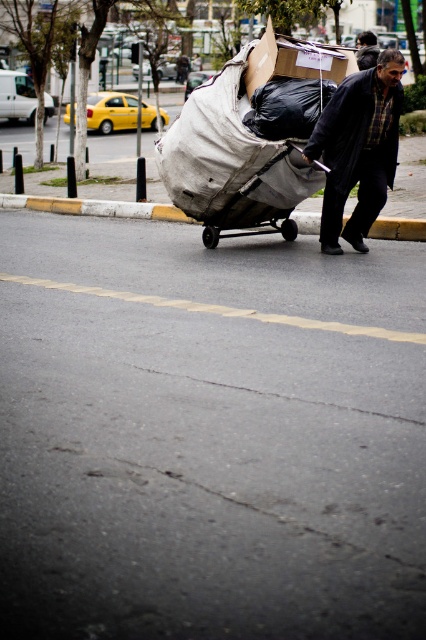
Question: Estimate the real-world distances between objects in this image. Which object is farther from the cardboard box at center?

Choices:
 (A) dark blue jacket at center
 (B) yellow concrete curb at lower center
 (C) matte black jacket at center

Answer: (B)

Question: Observing the image, what is the correct spatial positioning of yellow concrete curb at lower center in reference to cardboard box at center?

Choices:
 (A) below
 (B) above

Answer: (A)

Question: Does dark blue jacket at center have a greater width compared to yellow concrete curb at lower center?

Choices:
 (A) no
 (B) yes

Answer: (B)

Question: Considering the relative positions of yellow concrete curb at lower center and matte black jacket at center in the image provided, where is yellow concrete curb at lower center located with respect to matte black jacket at center?

Choices:
 (A) above
 (B) below

Answer: (B)

Question: Which point is farther from the camera taking this photo?

Choices:
 (A) (282, 52)
 (B) (374, 56)

Answer: (B)

Question: Which point appears closest to the camera in this image?

Choices:
 (A) tap(414, 230)
 (B) tap(373, 51)

Answer: (A)